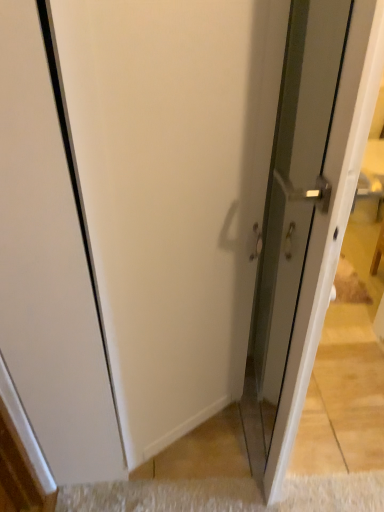
Find the location of a particular element. vacant space situated above white carpet at lower center (from a real-world perspective) is located at coordinates (274, 496).